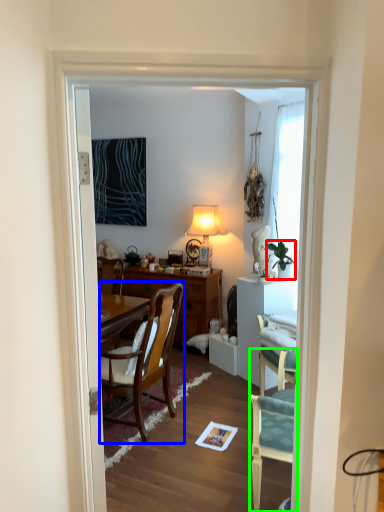
Question: Considering the real-world distances, which object is closest to houseplant (highlighted by a red box)? chair (highlighted by a blue box) or chair (highlighted by a green box).

Choices:
 (A) chair
 (B) chair

Answer: (A)